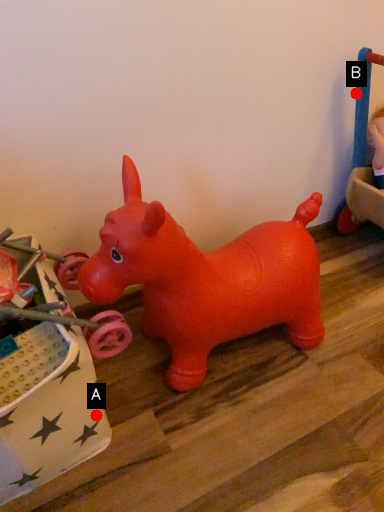
Question: Two points are circled on the image, labeled by A and B beside each circle. Which point is closer to the camera?

Choices:
 (A) A is closer
 (B) B is closer

Answer: (A)